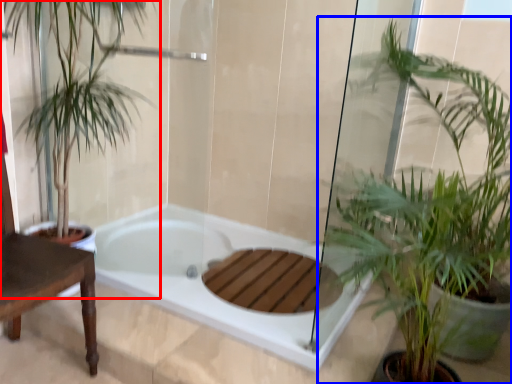
Question: Among these objects, which one is farthest to the camera, houseplant (highlighted by a red box) or houseplant (highlighted by a blue box)?

Choices:
 (A) houseplant
 (B) houseplant

Answer: (A)